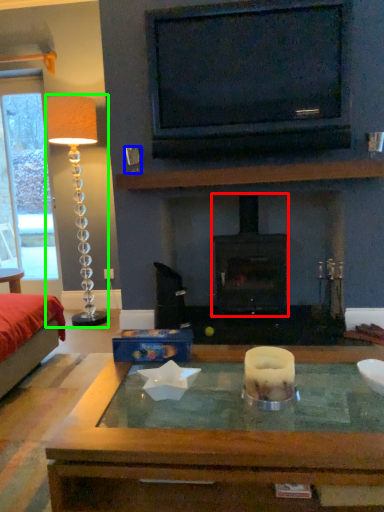
Question: Which object is the closest to the wood burning stove (highlighted by a red box)? Choose among these: coffee cup (highlighted by a blue box) or lamp (highlighted by a green box).

Choices:
 (A) coffee cup
 (B) lamp

Answer: (A)